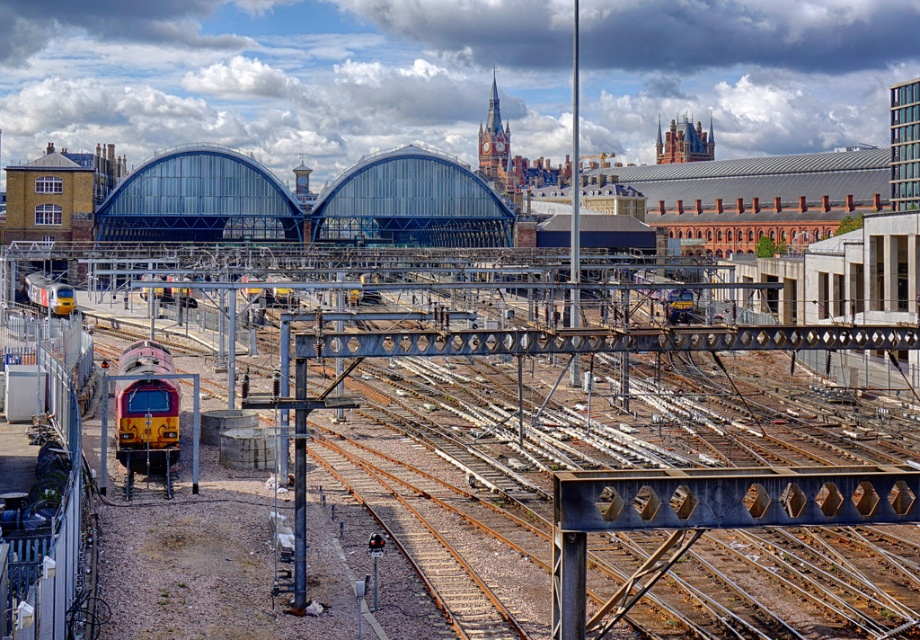
Question: Observing the image, what is the correct spatial positioning of yellow and purple locomotive at center in reference to yellow metallic train at left?

Choices:
 (A) below
 (B) above

Answer: (A)

Question: Can you confirm if yellow and purple locomotive at center is wider than yellow metallic train at left?

Choices:
 (A) no
 (B) yes

Answer: (A)

Question: Is yellow and purple locomotive at center positioned in front of yellow metallic train at left?

Choices:
 (A) no
 (B) yes

Answer: (B)